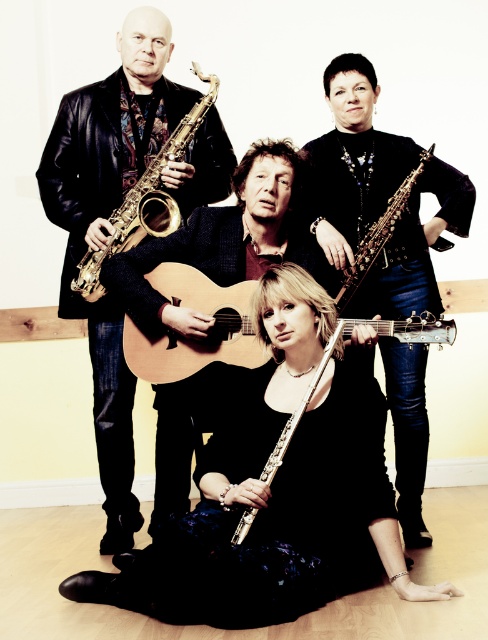
You are standing at the origin point in the room. Which of the two points, point (x=218, y=170) or point (x=421, y=307), is closer to you?

Point (x=421, y=307) is closer to you because it is in front of point (x=218, y=170).

You are a photographer adjusting the lighting in the studio. The shiny black saxophone at upper right and the acoustic wood guitar at center are casting shadows. Which object is closer to the light source?

The distance between the shiny black saxophone at upper right and the acoustic wood guitar at center is 22.71 inches. Since the saxophone is at the upper right and the guitar is at the center, the saxophone is closer to the light source because it is positioned higher and further to the right, which typically places it nearer in such setups.